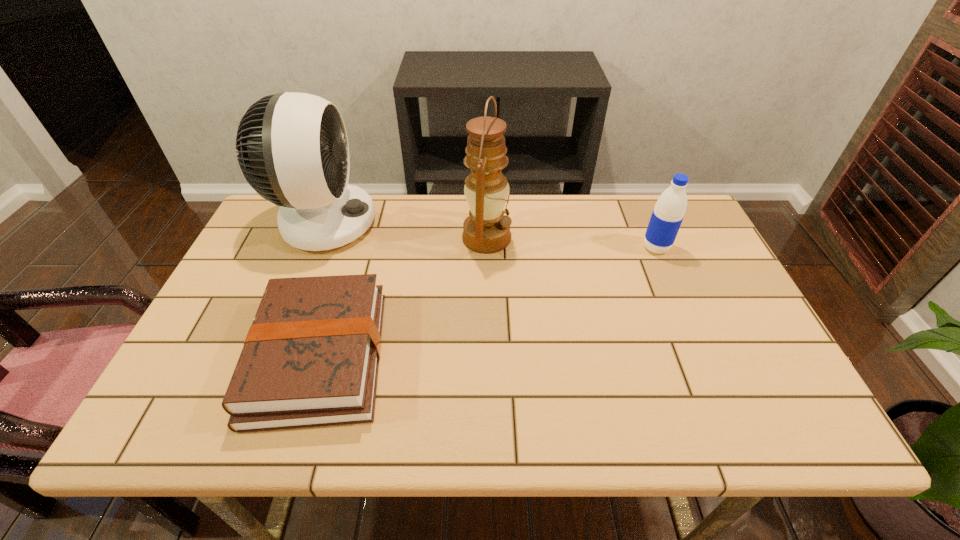
Identify which object is located as the second nearest to the fan. Please provide its 2D coordinates. Your answer should be formatted as a tuple, i.e. [(x, y)], where the tuple contains the x and y coordinates of a point satisfying the conditions above.

[(486, 230)]

The image size is (960, 540). In order to click on object that is the closest one to the shortest object in this screenshot , I will do `click(293, 149)`.

The image size is (960, 540). What are the coordinates of `free space that satisfies the following two spatial constraints: 1. on the grille of the third object from left to right; 2. on the right side of the fan` in the screenshot? It's located at (319, 238).

The width and height of the screenshot is (960, 540). Identify the location of vacant point that satisfies the following two spatial constraints: 1. on the grille of the fan; 2. on the left side of the water bottle. (314, 248).

Where is `free space that satisfies the following two spatial constraints: 1. on the grille of the fan; 2. on the back side of the second object from right to left`? The width and height of the screenshot is (960, 540). free space that satisfies the following two spatial constraints: 1. on the grille of the fan; 2. on the back side of the second object from right to left is located at coordinates (319, 238).

Locate an element on the screen. Image resolution: width=960 pixels, height=540 pixels. free location that satisfies the following two spatial constraints: 1. on the front side of the water bottle; 2. on the left side of the second object from right to left is located at coordinates (487, 248).

The image size is (960, 540). Identify the location of vacant region that satisfies the following two spatial constraints: 1. on the grille of the rightmost object; 2. on the right side of the fan. (314, 248).

This screenshot has width=960, height=540. What are the coordinates of `blank area in the image that satisfies the following two spatial constraints: 1. on the back side of the shortest object; 2. on the grille of the fan` in the screenshot? It's located at (360, 222).